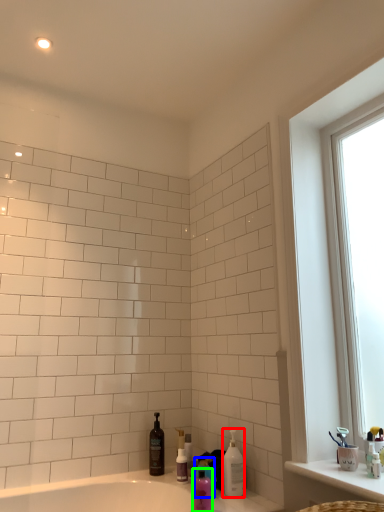
Question: Which object is positioned farthest from cleaning product (highlighted by a red box)? Select from cleaning product (highlighted by a blue box) and mouthwash (highlighted by a green box).

Choices:
 (A) cleaning product
 (B) mouthwash

Answer: (B)